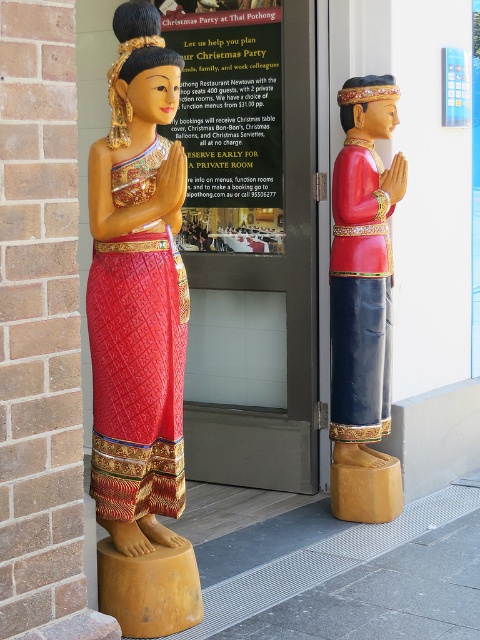
You are standing at the entrance of the building and want to take a photo of both the wooden statue at left and the wooden statue at right in the same frame. The camera you are using has a maximum focus range of 5 feet. Can you capture both statues in one photo without moving your position?

The wooden statue at left is 5.61 feet away from the wooden statue at right. Since the distance between them exceeds the camera maximum focus range of 5 feet, you cannot capture both statues in one photo without moving your position.

You are planning to place both wooden statue at left and wooden statue at right on a shelf that can only hold items up to the size of the smaller statue. Which statue should you choose to place on the shelf?

You should choose the wooden statue at right because it is smaller in size compared to the wooden statue at left, so it will fit on the shelf.

You are standing in front of the building entrance and want to take a photo of both wooden statue at left and wooden statue at right. Which statue should you focus on first to ensure both are in frame?

You should focus on the wooden statue at left first since it is closer to you than the wooden statue at right, ensuring both are in frame by adjusting the camera angle accordingly.